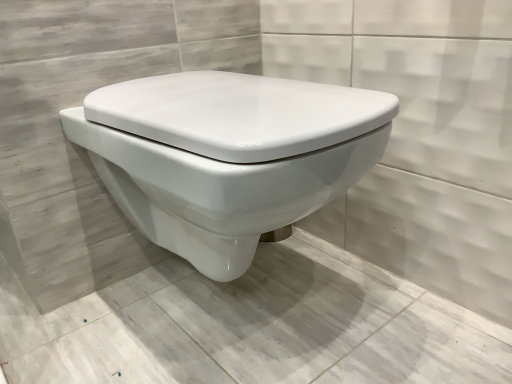
Where is `free point below white glossy toilet at center (from a real-world perspective)`? The image size is (512, 384). free point below white glossy toilet at center (from a real-world perspective) is located at coordinates (252, 320).